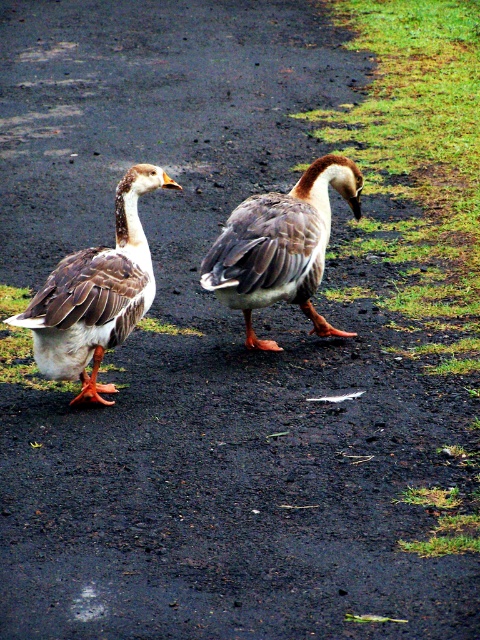
Question: Does speckled feathered duck at left come behind brown speckled feathers at center?

Choices:
 (A) yes
 (B) no

Answer: (B)

Question: Which of the following is the farthest from the observer?

Choices:
 (A) (316, 280)
 (B) (115, 280)

Answer: (A)

Question: Which object appears closest to the camera in this image?

Choices:
 (A) speckled feathered duck at left
 (B) brown speckled feathers at center

Answer: (A)

Question: Does speckled feathered duck at left come behind brown speckled feathers at center?

Choices:
 (A) no
 (B) yes

Answer: (A)

Question: Is speckled feathered duck at left to the right of brown speckled feathers at center from the viewer's perspective?

Choices:
 (A) no
 (B) yes

Answer: (A)